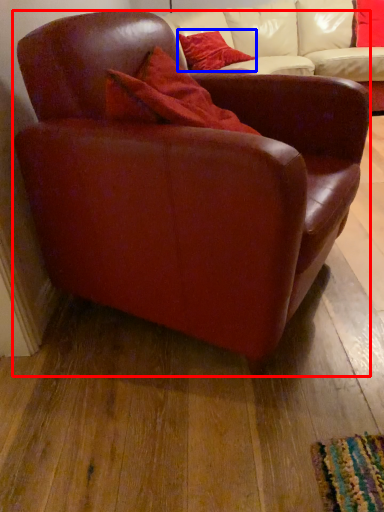
Question: Among these objects, which one is nearest to the camera, chair (highlighted by a red box) or pillow (highlighted by a blue box)?

Choices:
 (A) chair
 (B) pillow

Answer: (A)